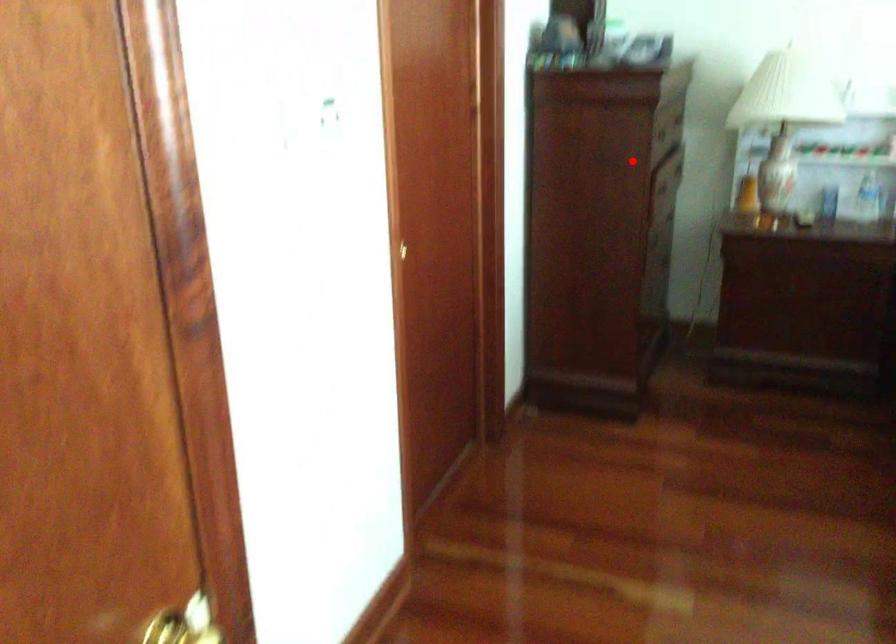
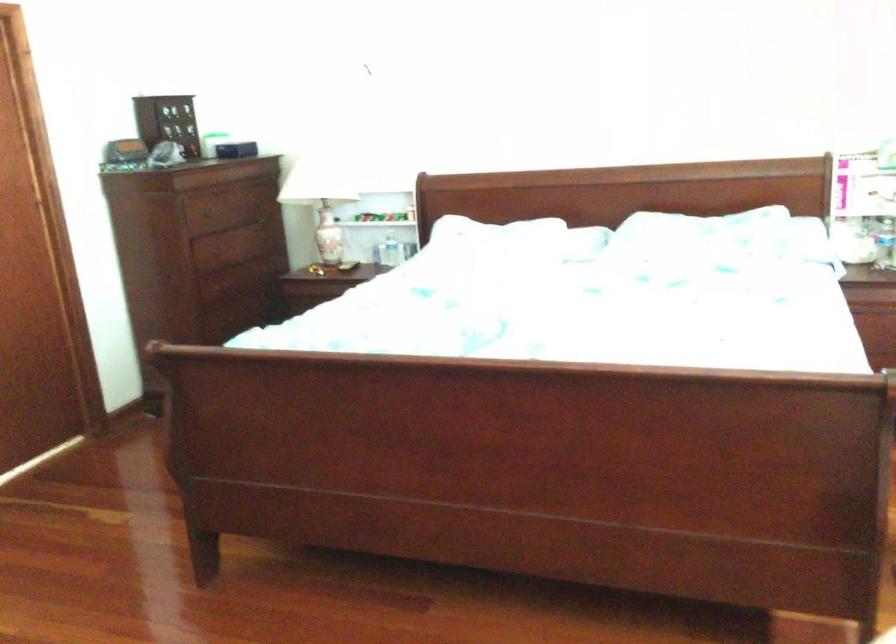
Find the pixel in the second image that matches the highlighted location in the first image.

(209, 252)